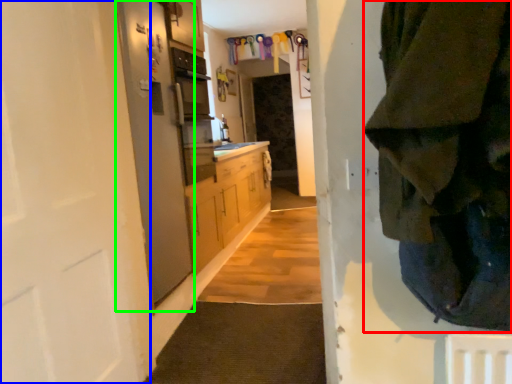
Question: Considering the real-world distances, which object is closest to clothing (highlighted by a red box)? door (highlighted by a blue box) or screen door (highlighted by a green box).

Choices:
 (A) door
 (B) screen door

Answer: (A)